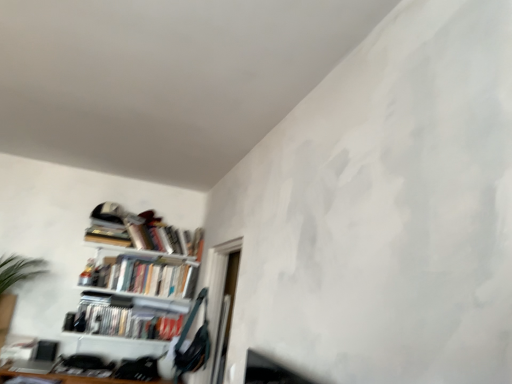
Question: In the image, is hardcover books at upper left, which appears as the first book when viewed from the top, on the left side or the right side of white glossy bookshelf at lower left, which is counted as the first book, starting from the bottom?

Choices:
 (A) right
 (B) left

Answer: (A)

Question: Is hardcover books at upper left, which is the 3th book in bottom-to-top order, bigger or smaller than white glossy bookshelf at lower left, which is the 3th book in top-to-bottom order?

Choices:
 (A) small
 (B) big

Answer: (B)

Question: Estimate the real-world distances between objects in this image. Which object is closer to the hardcover books at upper left, which is counted as the second book, starting from the bottom?

Choices:
 (A) hardcover books at upper left, which appears as the first book when viewed from the top
 (B) white glossy bookshelf at lower left, which is the 3th book in top-to-bottom order
 (C) metallic silver bookshelf at left
 (D) transparent glass door at center

Answer: (C)

Question: Estimate the real-world distances between objects in this image. Which object is farther from the transparent glass door at center?

Choices:
 (A) hardcover books at upper left, which appears as the first book when viewed from the top
 (B) white glossy bookshelf at lower left, which is the 3th book in top-to-bottom order
 (C) hardcover books at upper left, the second book when ordered from top to bottom
 (D) metallic silver bookshelf at left

Answer: (B)